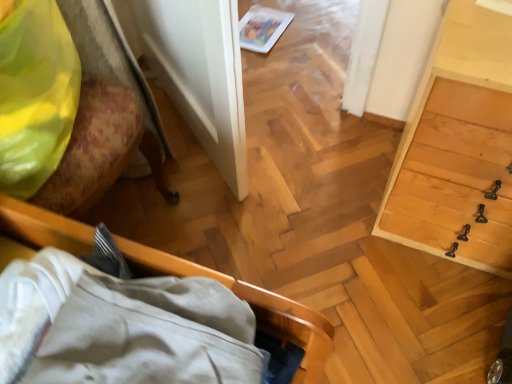
Where is `space that is in front of white glossy magazine at upper center`? Image resolution: width=512 pixels, height=384 pixels. space that is in front of white glossy magazine at upper center is located at coordinates (275, 59).